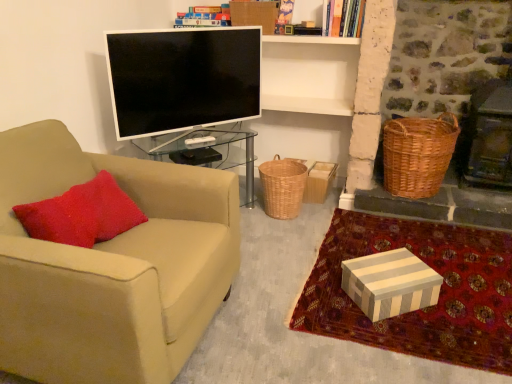
The image size is (512, 384). I want to click on free space that is to the left of striped cardboard box at lower right, so click(x=326, y=296).